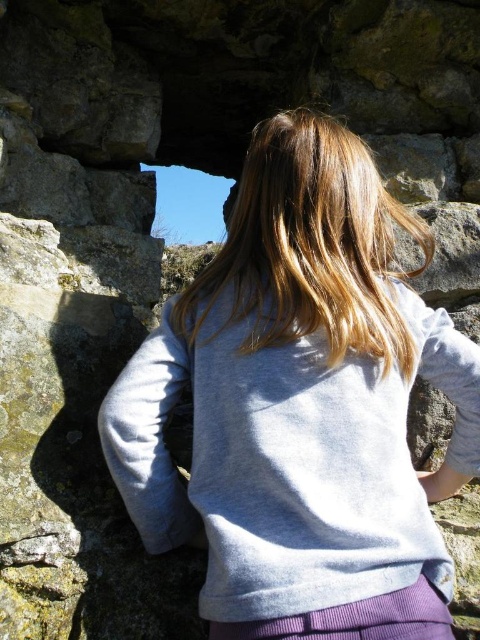
You are a drone operator trying to capture a photo of the light gray fleece at center. The camera is positioned at point 0,0. Which direction should you move the camera to align it with the fleece?

The light gray fleece at center is located at point [301,406], so you should move the camera upward and to the right to align with the fleece.

You are a photographer trying to capture the scene of the person standing in the ancient stone structure. You notice the light gray fleece at center and the blonde silky hair at center. Which object should you focus on first if you want to ensure both are in focus without adjusting the camera settings?

The light gray fleece at center is in front of the blonde silky hair at center. To keep both in focus, you should focus on the light gray fleece at center first since it is closer to the camera.